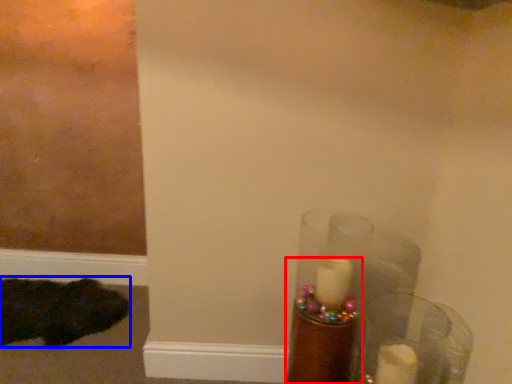
Question: Among these objects, which one is farthest to the camera, candle holder (highlighted by a red box) or animal (highlighted by a blue box)?

Choices:
 (A) candle holder
 (B) animal

Answer: (B)